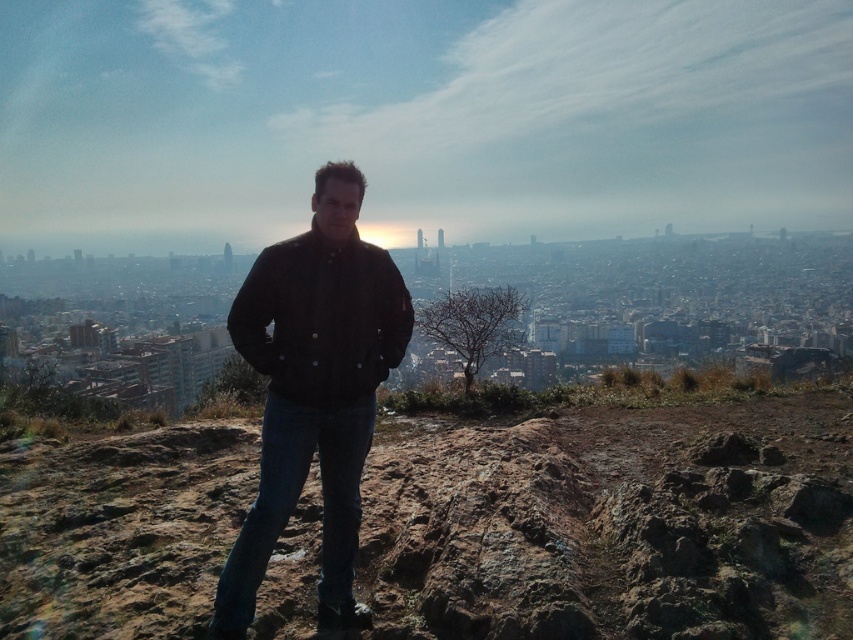
Is brown rocky hillside at center thinner than dark brown leather jacket at center?

In fact, brown rocky hillside at center might be wider than dark brown leather jacket at center.

Does brown rocky hillside at center lie behind dark brown leather jacket at center?

Yes, it is behind dark brown leather jacket at center.

Between point (561, 557) and point (354, 362), which one is positioned behind?

The point (354, 362) is behind.

In order to click on brown rocky hillside at center in this screenshot , I will do `click(613, 524)`.